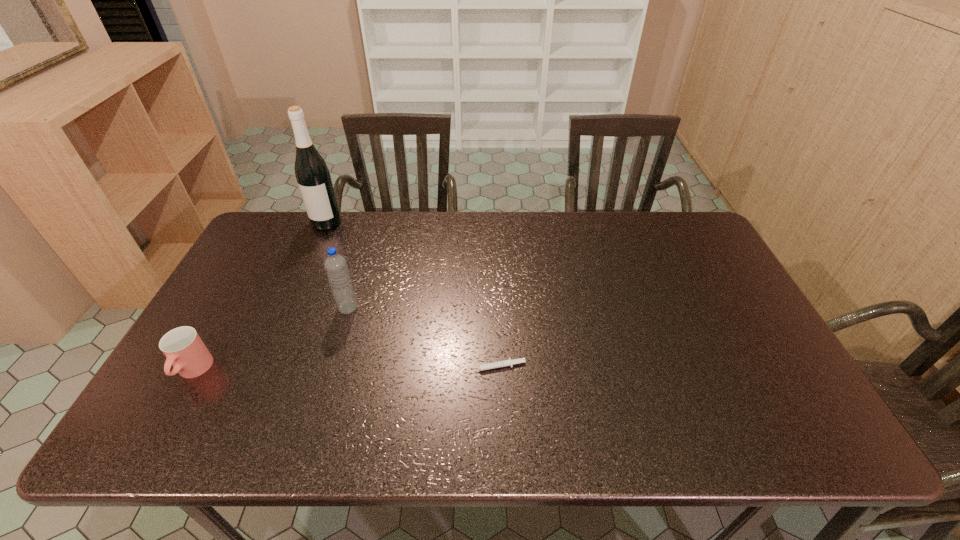
Locate an element on the screen. This screenshot has width=960, height=540. vacant point located 0.080m on the side of the cup with the handle is located at coordinates (163, 422).

You are a GUI agent. You are given a task and a screenshot of the screen. Output one action in this format:
    pyautogui.click(x=<x>, y=<y>)
    Task: Click on the vacant region located 0.110m on the back of the syringe
    This screenshot has height=540, width=960.
    Given the screenshot: What is the action you would take?
    pyautogui.click(x=493, y=327)

Identify the location of object positioned at the far edge. The image size is (960, 540). (312, 174).

Where is `object present at the left edge`? object present at the left edge is located at coordinates coord(184,349).

In the image, there is a desktop. At what (x,y) coordinates should I click in order to perform the action: click on blank space at the far edge. Please return your answer as a coordinate pair (x, y). The width and height of the screenshot is (960, 540). Looking at the image, I should click on coord(421,234).

In the image, there is a desktop. Identify the location of vacant space at the near edge. (393, 418).

This screenshot has height=540, width=960. In the image, there is a desktop. What are the coordinates of `free region at the right edge` in the screenshot? It's located at (686, 257).

Find the location of a particular element. The image size is (960, 540). vacant space at the far left corner of the desktop is located at coordinates (305, 211).

You are a GUI agent. You are given a task and a screenshot of the screen. Output one action in this format:
    pyautogui.click(x=<x>, y=<y>)
    Task: Click on the vacant area that lies between the water bottle and the leftmost object
    This screenshot has height=540, width=960.
    Given the screenshot: What is the action you would take?
    pyautogui.click(x=271, y=340)

The image size is (960, 540). I want to click on free space that is in between the third object from left to right and the rightmost object, so click(421, 337).